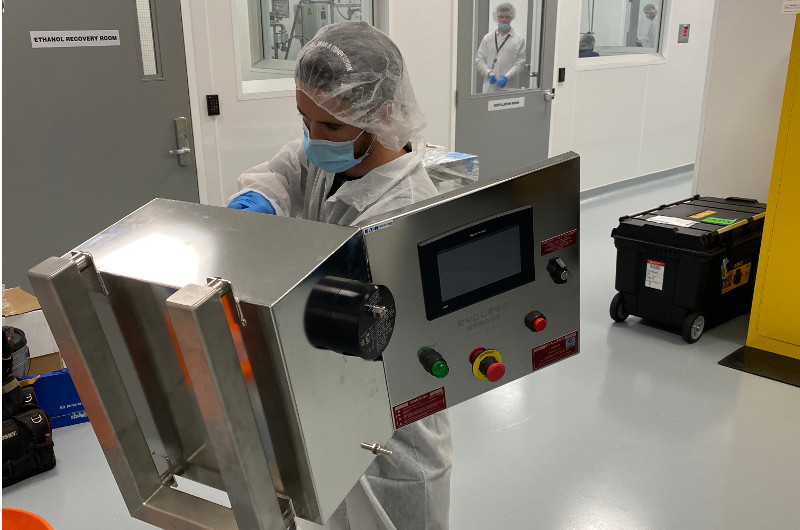
In order to click on floor in this screenshot , I will do `click(638, 466)`.